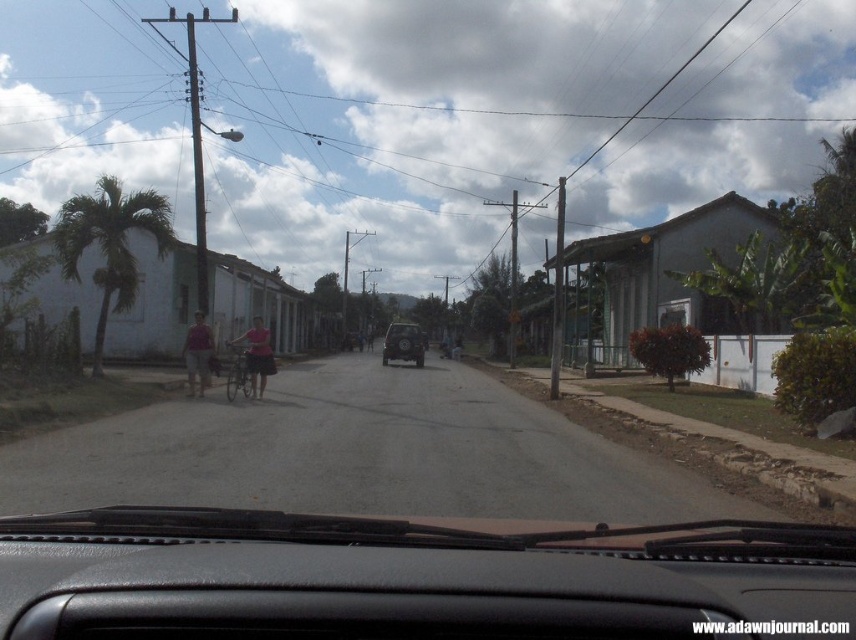
You are sitting in the driver seat of the vehicle and want to check if the point at coordinates point [129,202] is closer to you than point [254,358]. Based on the scene, can you confirm this?

Point [129,202] is further to the camera than point [254,358], so it is not closer to you.

You are driving a car that is 15 feet long and need to park it in a spot where there is a dark SUV parked on the right side of the road. The parking space between the camera and point (186, 385) is 66.56 feet away. Can your car fit into this space?

The distance between the camera and point (186, 385) is 66.56 feet. Since your car is only 15 feet long, it can easily fit into this space.